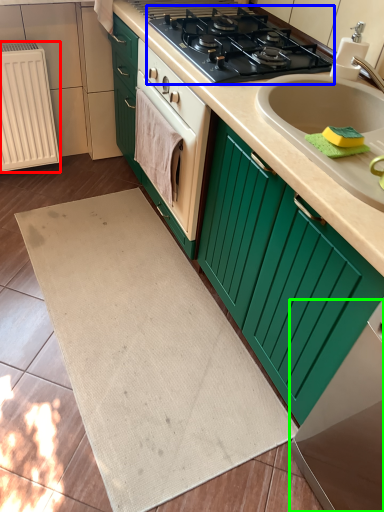
Question: Based on their relative distances, which object is nearer to radiator (highlighted by a red box)? Choose from gas stove (highlighted by a blue box) and appliance (highlighted by a green box).

Choices:
 (A) gas stove
 (B) appliance

Answer: (A)